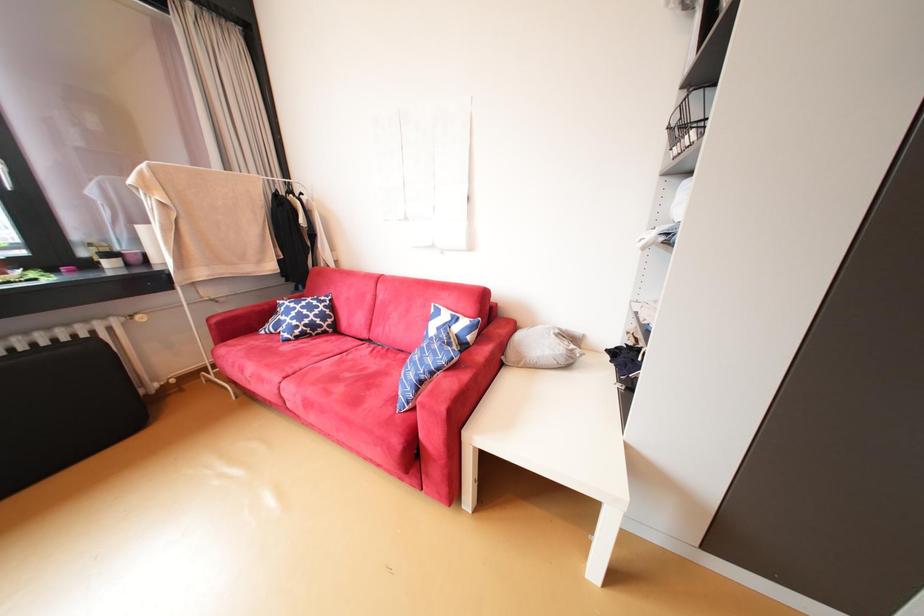
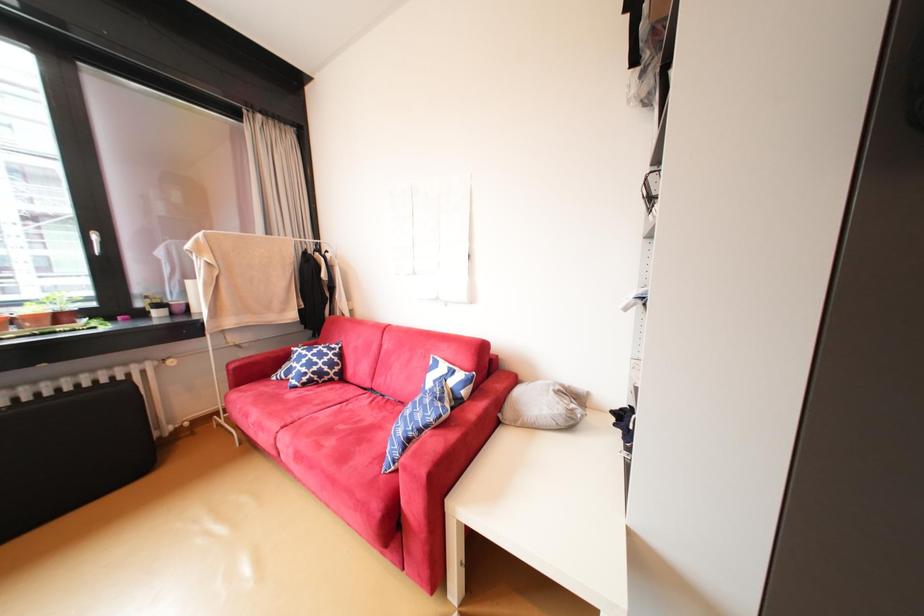
Question: Based on the continuous images, in which direction is the camera rotating? Reply with the corresponding letter.

Choices:
 (A) Left
 (B) Right
 (C) Up
 (D) Down

Answer: (C)